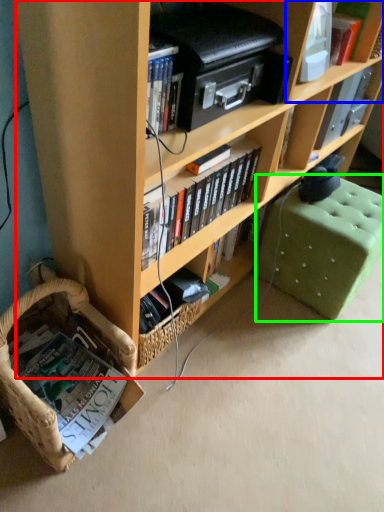
Question: Which object is positioned closest to bookcase (highlighted by a red box)? Select from shelf (highlighted by a blue box) and swivel chair (highlighted by a green box).

Choices:
 (A) shelf
 (B) swivel chair

Answer: (B)